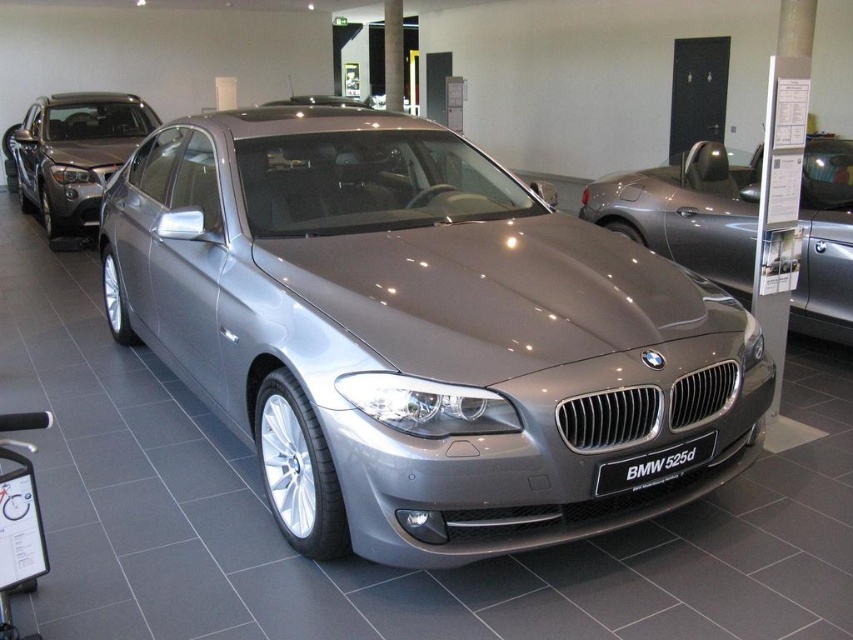
Question: Which of the following is the farthest from the observer?

Choices:
 (A) satin silver metallic sedan at center
 (B) satin metallic car at center

Answer: (A)

Question: Can you confirm if satin silver metallic car at center is positioned below satin silver metallic sedan at center?

Choices:
 (A) no
 (B) yes

Answer: (B)

Question: Which of the following is the closest to the observer?

Choices:
 (A) (598, 186)
 (B) (102, 152)
 (C) (277, 172)

Answer: (C)

Question: Which object is closer to the camera taking this photo?

Choices:
 (A) satin silver metallic sedan at center
 (B) satin silver metallic car at center

Answer: (B)

Question: Does satin metallic car at center come behind satin silver metallic car at center?

Choices:
 (A) no
 (B) yes

Answer: (A)

Question: Is satin silver metallic car at center below satin silver metallic sedan at center?

Choices:
 (A) no
 (B) yes

Answer: (B)